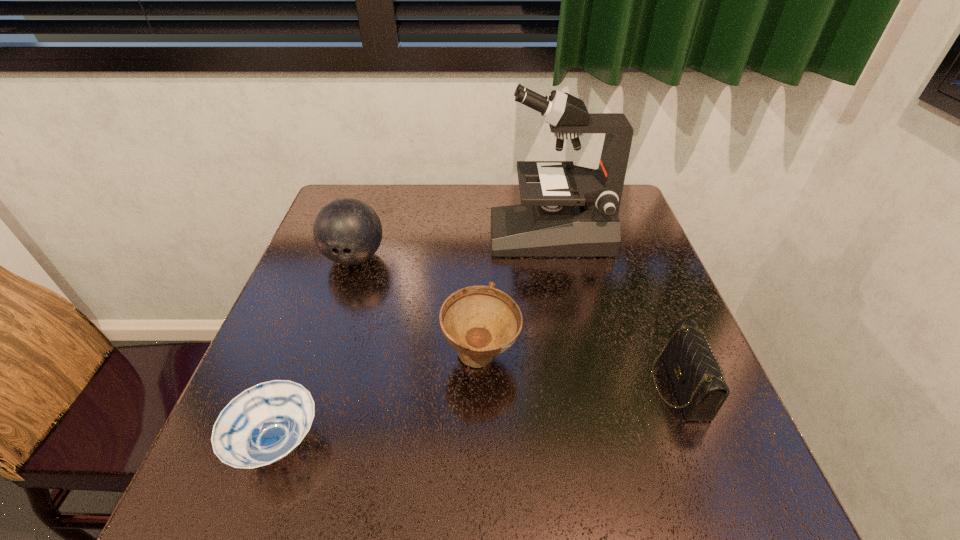
At what (x,y) coordinates should I click in order to perform the action: click on microscope. Please return your answer as a coordinate pair (x, y). This screenshot has width=960, height=540. Looking at the image, I should click on (573, 212).

Where is `the fourth shortest object`? The height and width of the screenshot is (540, 960). the fourth shortest object is located at coordinates (347, 231).

Where is `the farther soup bowl`? The image size is (960, 540). the farther soup bowl is located at coordinates (480, 322).

I want to click on the right soup bowl, so click(x=480, y=322).

You are a GUI agent. You are given a task and a screenshot of the screen. Output one action in this format:
    pyautogui.click(x=<x>, y=<y>)
    Task: Click on the clutch bag
    The image size is (960, 540).
    Given the screenshot: What is the action you would take?
    pyautogui.click(x=693, y=368)

Locate an element on the screen. the left soup bowl is located at coordinates (265, 423).

Where is `the shortest object`? This screenshot has width=960, height=540. the shortest object is located at coordinates (265, 423).

In order to click on vacant space located through the eyepieces of the tallest object in this screenshot , I will do `click(426, 234)`.

The height and width of the screenshot is (540, 960). Find the location of `free location located 0.230m through the eyepieces of the tallest object`. free location located 0.230m through the eyepieces of the tallest object is located at coordinates (408, 234).

The image size is (960, 540). I want to click on free space located 0.280m through the eyepieces of the tallest object, so click(x=390, y=234).